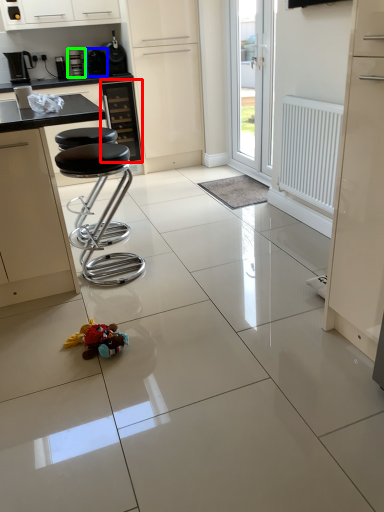
Question: Considering the real-world distances, which object is closest to cabinetry (highlighted by a red box)? appliance (highlighted by a blue box) or coffee machine (highlighted by a green box).

Choices:
 (A) appliance
 (B) coffee machine

Answer: (A)